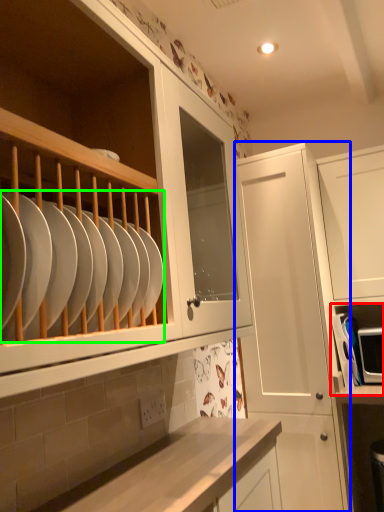
Question: Which is farther away from shelf (highlighted by a red box)? cabinetry (highlighted by a blue box) or tableware (highlighted by a green box)?

Choices:
 (A) cabinetry
 (B) tableware

Answer: (B)